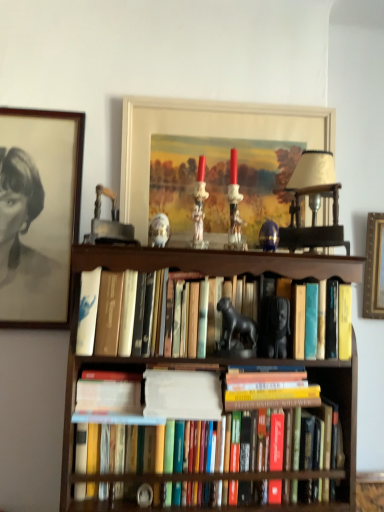
I want to click on free space above matte white picture frame at upper center, the second picture frame when ordered from left to right (from a real-world perspective), so (228, 101).